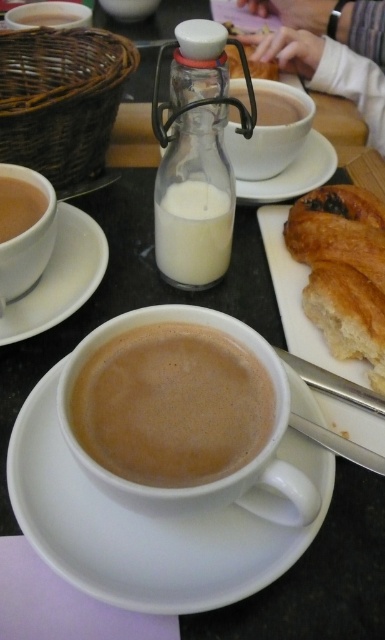
Can you confirm if golden brown flaky croissant at right is positioned to the left of white ceramic saucer at upper left?

In fact, golden brown flaky croissant at right is to the right of white ceramic saucer at upper left.

Where is `golden brown flaky croissant at right`? Image resolution: width=385 pixels, height=640 pixels. golden brown flaky croissant at right is located at coordinates (343, 269).

Where is `brown matte cup at center`? This screenshot has height=640, width=385. brown matte cup at center is located at coordinates (172, 404).

Image resolution: width=385 pixels, height=640 pixels. Describe the element at coordinates (172, 404) in the screenshot. I see `brown matte cup at center` at that location.

Identify the location of brown matte cup at center. (172, 404).

The image size is (385, 640). I want to click on brown matte cup at center, so click(x=172, y=404).

Between point (63, 273) and point (182, 282), which one is positioned behind?

Positioned behind is point (182, 282).

Measure the distance between white ceramic saucer at upper left and camera.

white ceramic saucer at upper left is 15.26 inches away from camera.

Consider the image. Measure the distance between white ceramic saucer at upper left and camera.

A distance of 15.26 inches exists between white ceramic saucer at upper left and camera.

The image size is (385, 640). What are the coordinates of `white ceramic saucer at upper left` in the screenshot? It's located at (60, 276).